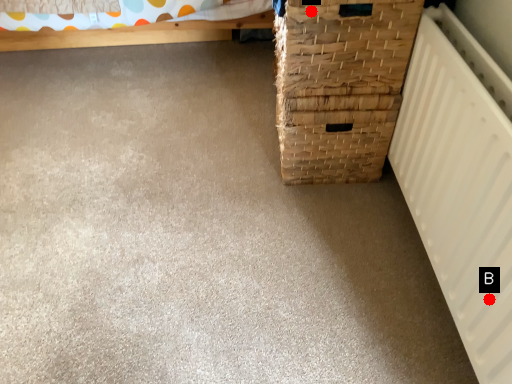
Question: Two points are circled on the image, labeled by A and B beside each circle. Which point is farther from the camera taking this photo?

Choices:
 (A) A is further
 (B) B is further

Answer: (A)